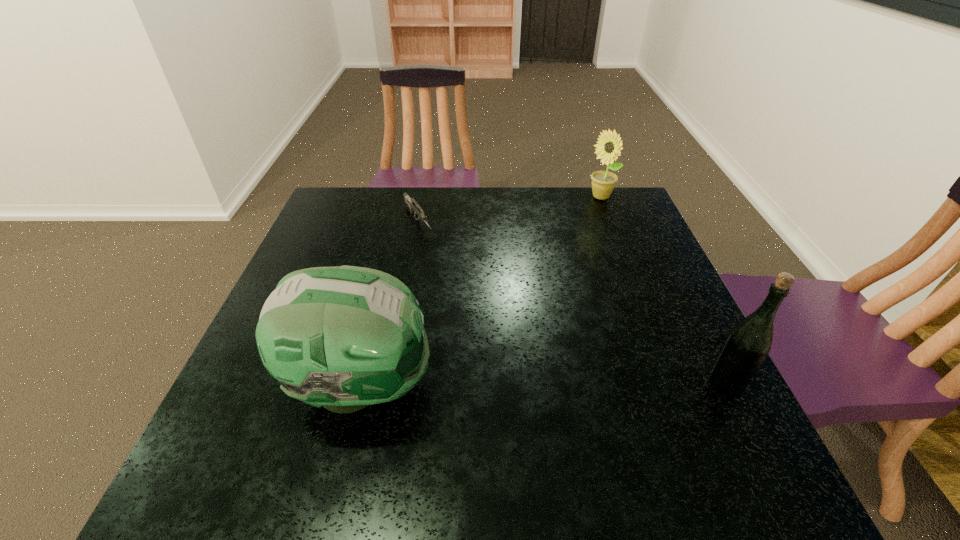
You are a GUI agent. You are given a task and a screenshot of the screen. Output one action in this format:
    pyautogui.click(x=<x>, y=<y>)
    Task: Click on the free spot between the gun and the rightmost object
    The width and height of the screenshot is (960, 540).
    Given the screenshot: What is the action you would take?
    (x=571, y=302)

At what (x,y) coordinates should I click in order to perform the action: click on free spot between the beer bottle and the shortest object. Please return your answer as a coordinate pair (x, y). The image size is (960, 540). Looking at the image, I should click on (571, 302).

The width and height of the screenshot is (960, 540). I want to click on vacant region between the second object from right to left and the beer bottle, so click(x=663, y=291).

Locate an element on the screen. The width and height of the screenshot is (960, 540). unoccupied position between the beer bottle and the sunflower is located at coordinates (663, 291).

You are a GUI agent. You are given a task and a screenshot of the screen. Output one action in this format:
    pyautogui.click(x=<x>, y=<y>)
    Task: Click on the free spot between the third tallest object and the beer bottle
    The width and height of the screenshot is (960, 540).
    Given the screenshot: What is the action you would take?
    pyautogui.click(x=663, y=291)

Where is `free spot between the gun and the third object from left to right`? free spot between the gun and the third object from left to right is located at coordinates (510, 210).

Find the location of a particular element. Image resolution: width=960 pixels, height=540 pixels. vacant point located between the gun and the beer bottle is located at coordinates (571, 302).

Where is `free space between the sunflower and the gun`? free space between the sunflower and the gun is located at coordinates (510, 210).

Select which object is the closest to the second shortest object. Please provide its 2D coordinates. Your answer should be formatted as a tuple, i.e. [(x, y)], where the tuple contains the x and y coordinates of a point satisfying the conditions above.

[(412, 204)]

The width and height of the screenshot is (960, 540). What are the coordinates of `object that is the third closest to the beer bottle` in the screenshot? It's located at (412, 204).